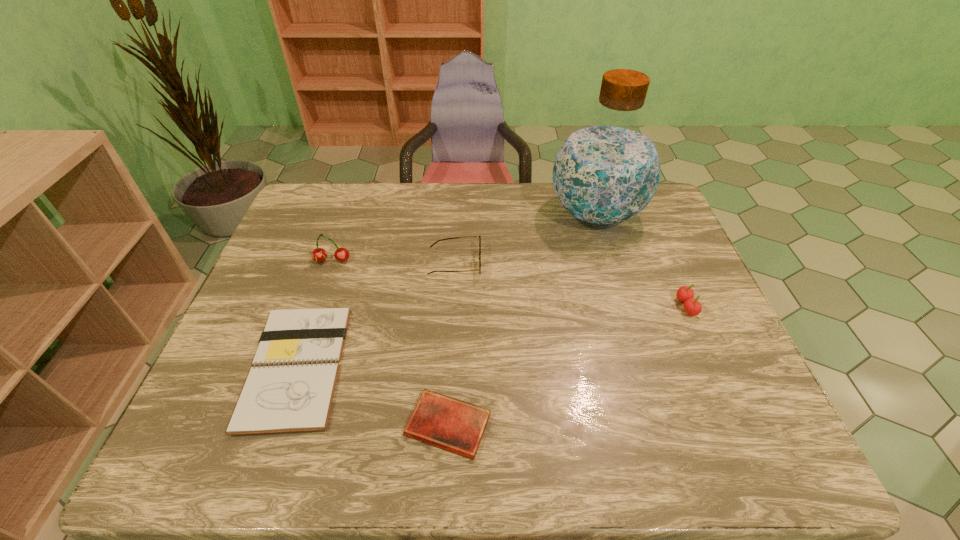
I want to click on cherry that is at the right edge, so pos(685,294).

You are a GUI agent. You are given a task and a screenshot of the screen. Output one action in this format:
    pyautogui.click(x=<x>, y=<y>)
    Task: Click on the object at the near left corner
    The width and height of the screenshot is (960, 540).
    Given the screenshot: What is the action you would take?
    pyautogui.click(x=290, y=388)

Locate an element on the screen. The width and height of the screenshot is (960, 540). object situated at the far right corner is located at coordinates (606, 172).

Identify the location of free location at the far edge of the desktop. (387, 208).

Where is `vacant space at the near edge`? The image size is (960, 540). vacant space at the near edge is located at coordinates (698, 467).

Identify the location of vacant space at the left edge of the desktop. Image resolution: width=960 pixels, height=540 pixels. [293, 240].

Locate an element on the screen. vacant space at the right edge of the desktop is located at coordinates (686, 372).

The image size is (960, 540). What are the coordinates of `vacant region between the spectacles and the shortest object` in the screenshot? It's located at (451, 344).

You are a GUI agent. You are given a task and a screenshot of the screen. Output one action in this format:
    pyautogui.click(x=<x>, y=<y>)
    Task: Click on the free space between the notepad and the right cherry
    This screenshot has height=540, width=960.
    Given the screenshot: What is the action you would take?
    pyautogui.click(x=492, y=336)

Identify the location of free space between the fourth tallest object and the second tallest object. (394, 262).